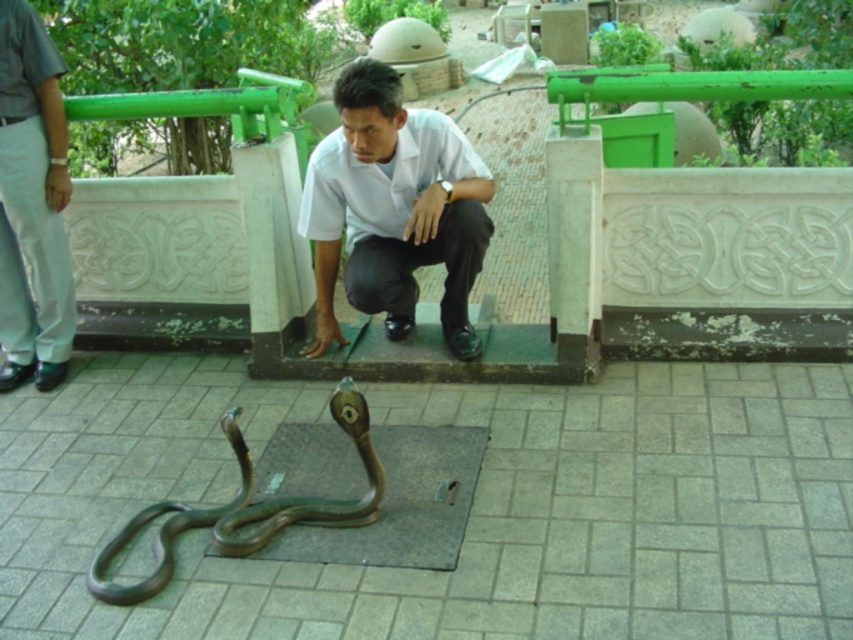
Question: Which object is closer to the camera taking this photo?

Choices:
 (A) gray cotton pants at left
 (B) shiny bronze snake at lower center

Answer: (B)

Question: Which object appears farthest from the camera in this image?

Choices:
 (A) gray cotton pants at left
 (B) white smooth shirt at center
 (C) shiny bronze snake at lower center

Answer: (A)

Question: Which point is farther from the camera taking this photo?

Choices:
 (A) (231, 502)
 (B) (21, 381)
 (C) (387, 108)

Answer: (B)

Question: Is white smooth shirt at center thinner than shiny bronze snake at lower center?

Choices:
 (A) yes
 (B) no

Answer: (A)

Question: Does gray cotton pants at left have a lesser width compared to shiny bronze snake at lower center?

Choices:
 (A) yes
 (B) no

Answer: (A)

Question: Is white smooth shirt at center smaller than shiny bronze snake at lower center?

Choices:
 (A) yes
 (B) no

Answer: (B)